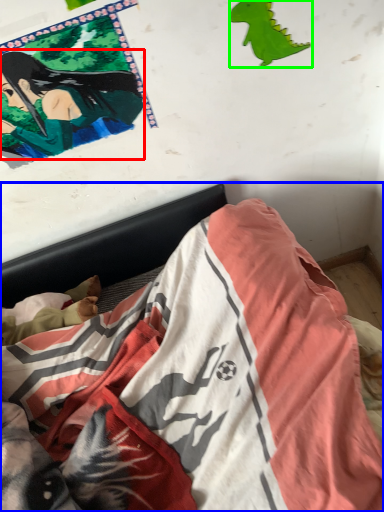
Question: Which is nearer to the person (highlighted by a red box)? bed (highlighted by a blue box) or print (highlighted by a green box).

Choices:
 (A) bed
 (B) print

Answer: (B)